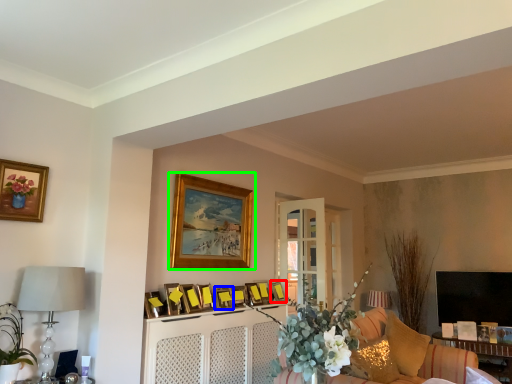
Question: Which is nearer to the picture frame (highlighted by a red box)? picture frame (highlighted by a blue box) or picture frame (highlighted by a green box).

Choices:
 (A) picture frame
 (B) picture frame

Answer: (A)